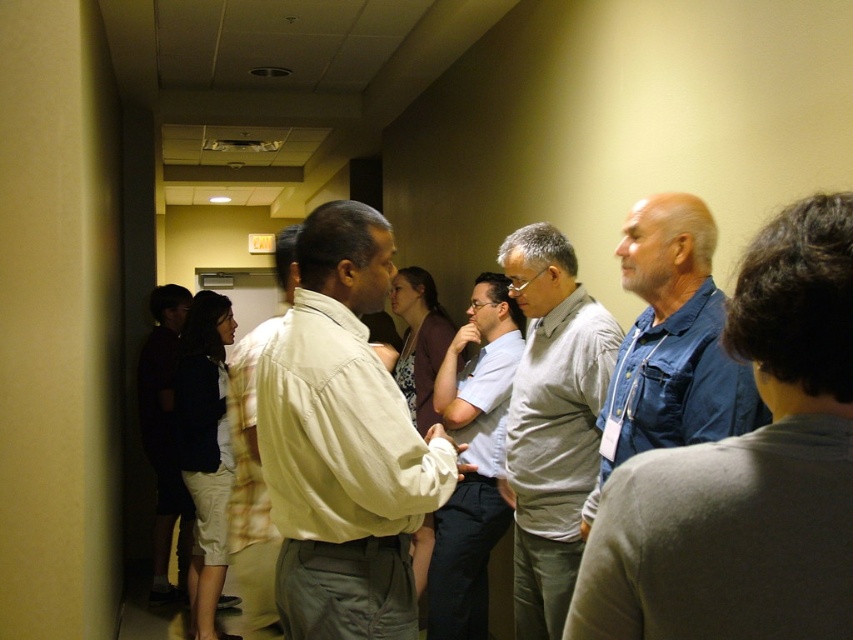
Question: Is gray matte shirt at center behind dark blue shirt at left?

Choices:
 (A) no
 (B) yes

Answer: (A)

Question: Estimate the real-world distances between objects in this image. Which object is closer to the light beige shirt at center?

Choices:
 (A) light blue shirt at center
 (B) dark blue shirt at left

Answer: (A)

Question: Which point is closer to the camera?

Choices:
 (A) (473, 289)
 (B) (279, 324)

Answer: (B)

Question: From the image, what is the correct spatial relationship of light blue shirt at center in relation to light beige shirt at center?

Choices:
 (A) below
 (B) above

Answer: (A)

Question: Does denim jacket at right appear under light beige shirt at center?

Choices:
 (A) no
 (B) yes

Answer: (A)

Question: Which point is closer to the camera?

Choices:
 (A) (257, 388)
 (B) (161, 566)
 (C) (693, 364)
 (D) (532, 563)

Answer: (C)